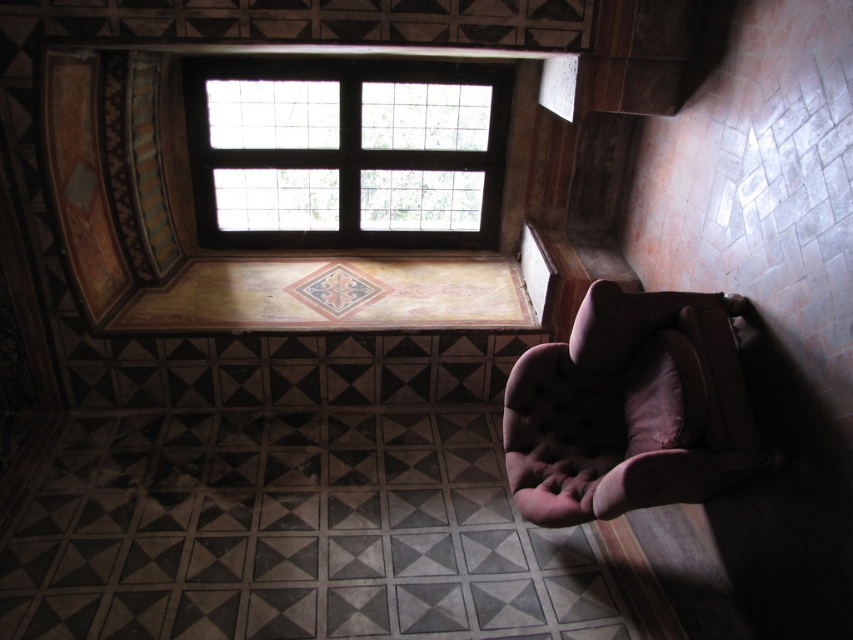
Is wooden grid window at upper center smaller than velvet brown armchair at lower right?

No.

Is wooden grid window at upper center positioned before velvet brown armchair at lower right?

No, wooden grid window at upper center is behind velvet brown armchair at lower right.

Where is `wooden grid window at upper center`? This screenshot has width=853, height=640. wooden grid window at upper center is located at coordinates (345, 150).